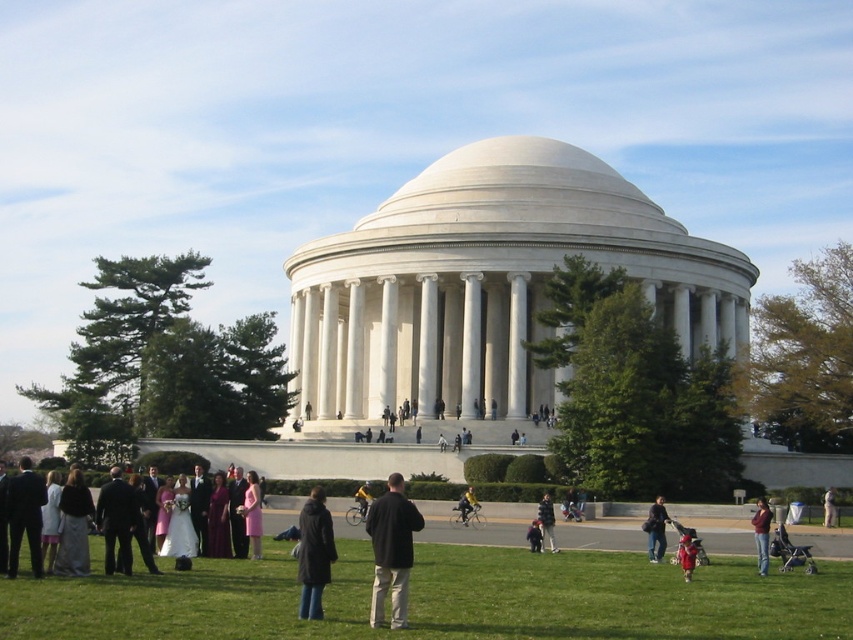
You are standing at the Jefferson Memorial and want to reach a specific point marked at coordinates point (815, 602). If you can walk 1 meter per second, how many seconds will it take you to reach that point?

The distance of point (815, 602) from viewer is 33.11 meters, so it will take approximately 33.11 seconds to reach the point since you walk at 1 meter per second.

You are attending a ceremony at the Jefferson Memorial and notice two dresses in the crowd. The matte white dress at center and the pink satin dress at center are both in your line of sight. Which dress is closer to you?

The matte white dress at center is closer to you because it is positioned under the pink satin dress at center, indicating it is in front.

You are a photographer at the Jefferson Memorial. You see the green grass at lower center and the red fabric dress at lower right. Which object is closer to the camera?

The red fabric dress at lower right is closer to the camera because the green grass at lower center is positioned under it, indicating it is behind the dress.